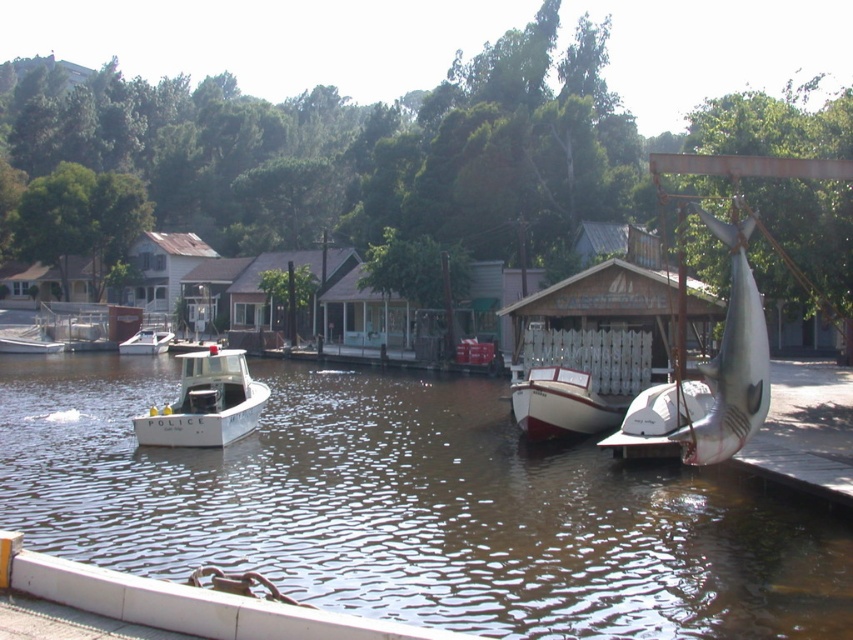
Question: Does brown water at center have a larger size compared to white matte police boat at center?

Choices:
 (A) yes
 (B) no

Answer: (A)

Question: Which is nearer to the white matte police boat at center?

Choices:
 (A) white matte police boat at left
 (B) brown water at center

Answer: (A)

Question: Can you confirm if brown water at center is smaller than white matte boat at center?

Choices:
 (A) no
 (B) yes

Answer: (A)

Question: Which object is farther from the camera taking this photo?

Choices:
 (A) white matte police boat at center
 (B) brown water at center

Answer: (A)

Question: Which point is closer to the camera?

Choices:
 (A) brown water at center
 (B) white matte boat at center

Answer: (A)

Question: Is brown water at center in front of white matte police boat at left?

Choices:
 (A) yes
 (B) no

Answer: (A)